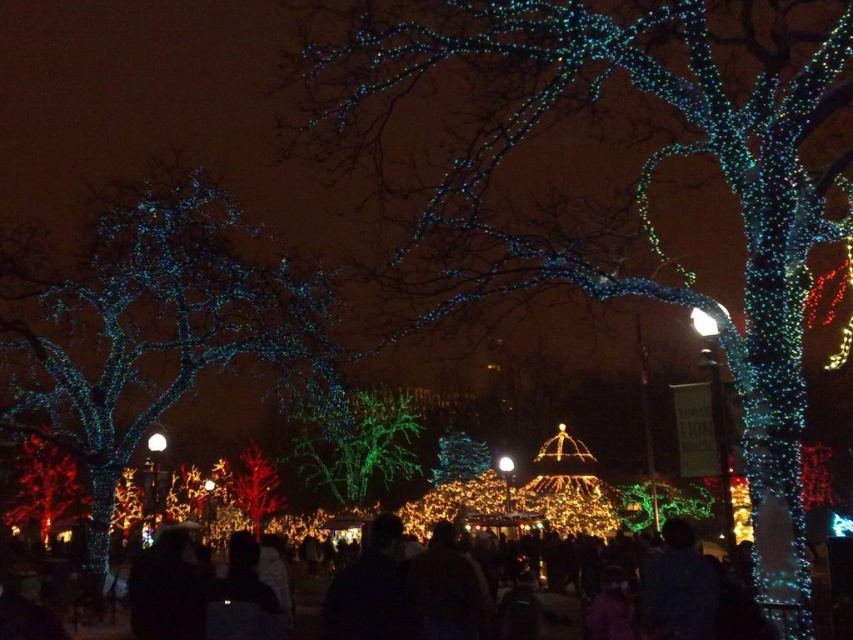
Is point (467, 147) farther from camera compared to point (262, 496)?

No, (467, 147) is closer to viewer.

Identify the location of illuminated wire at upper center. pos(637,189).

Is point (743, 440) behind point (260, 481)?

That is False.

You are a GUI agent. You are given a task and a screenshot of the screen. Output one action in this format:
    pyautogui.click(x=<x>, y=<y>)
    Task: Click on the illuminated wire at upper center
    This screenshot has width=853, height=640.
    Given the screenshot: What is the action you would take?
    pyautogui.click(x=637, y=189)

Between iridescent glass tree at center and white matte light at center, which one appears on the right side from the viewer's perspective?

iridescent glass tree at center is more to the right.

Is iridescent glass tree at center positioned before white matte light at center?

No, it is not.

Between point (450, 458) and point (157, 445), which one is positioned in front?

Point (157, 445) is more forward.

The width and height of the screenshot is (853, 640). I want to click on iridescent glass tree at center, so click(459, 458).

Can you confirm if iridescent glass tree at center is smaller than white glossy light at center?

No.

Does iridescent glass tree at center have a greater width compared to white glossy light at center?

Yes.

Where is `iridescent glass tree at center`? This screenshot has width=853, height=640. iridescent glass tree at center is located at coordinates (459, 458).

Identify the location of iridescent glass tree at center. This screenshot has height=640, width=853. (459, 458).